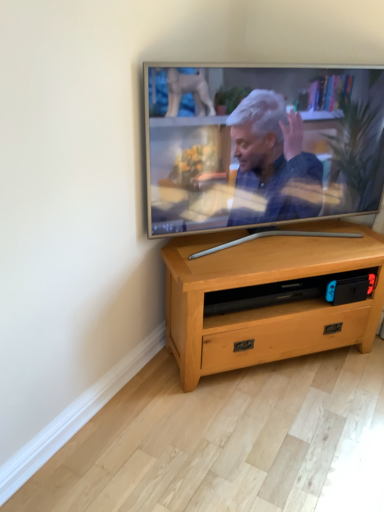
Question: From a real-world perspective, is light wood/texture tv stand at center positioned over silver metallic television at upper center based on gravity?

Choices:
 (A) yes
 (B) no

Answer: (B)

Question: Is the position of light wood/texture tv stand at center less distant than that of silver metallic television at upper center?

Choices:
 (A) no
 (B) yes

Answer: (A)

Question: Is silver metallic television at upper center inside light wood/texture tv stand at center?

Choices:
 (A) no
 (B) yes

Answer: (A)

Question: From the image's perspective, is light wood/texture tv stand at center above silver metallic television at upper center?

Choices:
 (A) yes
 (B) no

Answer: (B)

Question: Are light wood/texture tv stand at center and silver metallic television at upper center making contact?

Choices:
 (A) yes
 (B) no

Answer: (B)

Question: Would you say light wood/texture tv stand at center is outside silver metallic television at upper center?

Choices:
 (A) yes
 (B) no

Answer: (A)

Question: Could you tell me if silver metallic television at upper center is turned towards light wood/texture tv stand at center?

Choices:
 (A) yes
 (B) no

Answer: (B)

Question: Is silver metallic television at upper center touching light wood/texture tv stand at center?

Choices:
 (A) no
 (B) yes

Answer: (A)

Question: Can you confirm if silver metallic television at upper center is positioned to the right of light wood/texture tv stand at center?

Choices:
 (A) yes
 (B) no

Answer: (B)

Question: Considering the relative sizes of silver metallic television at upper center and light wood/texture tv stand at center in the image provided, is silver metallic television at upper center wider than light wood/texture tv stand at center?

Choices:
 (A) no
 (B) yes

Answer: (A)

Question: From a real-world perspective, does silver metallic television at upper center stand above light wood/texture tv stand at center?

Choices:
 (A) yes
 (B) no

Answer: (A)

Question: Does silver metallic television at upper center have a greater height compared to light wood/texture tv stand at center?

Choices:
 (A) no
 (B) yes

Answer: (B)

Question: Relative to light wood/texture tv stand at center, is silver metallic television at upper center in front or behind?

Choices:
 (A) behind
 (B) front

Answer: (B)